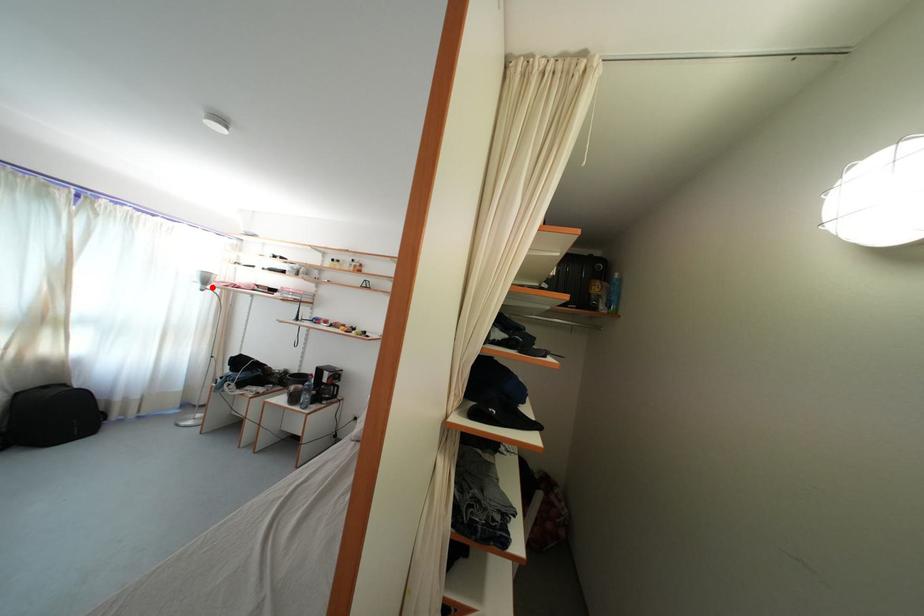
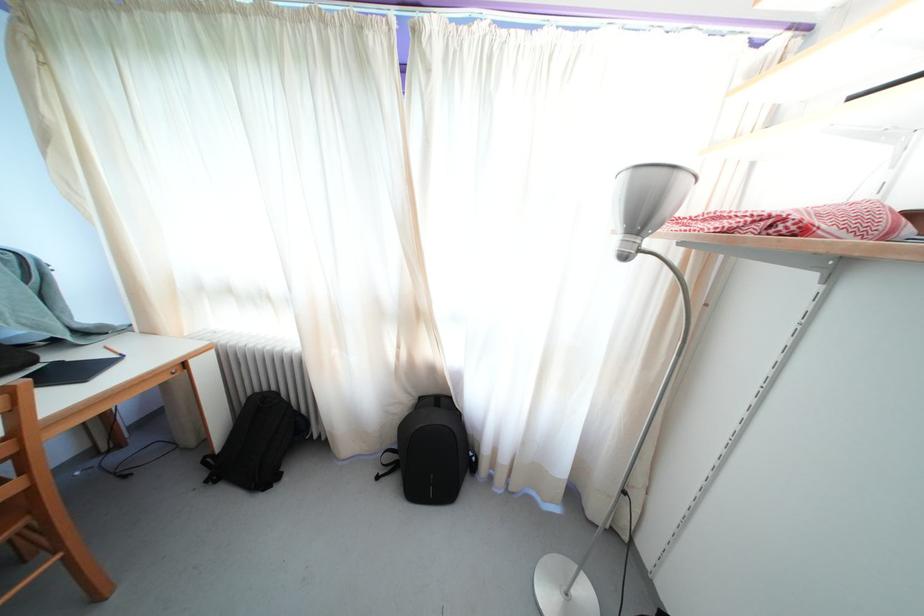
Locate, in the second image, the point that corresponds to the highlighted location in the first image.

(648, 223)